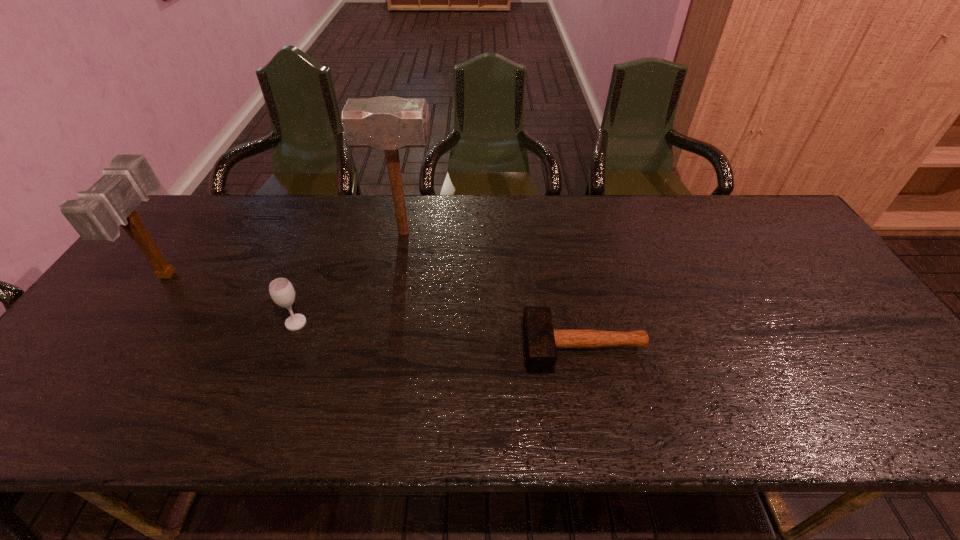
Locate an element on the screen. This screenshot has height=540, width=960. vacant area situated 0.310m on the left of the third tallest object is located at coordinates (163, 323).

Where is `free space located on the hammer head face of the shortest mallet`? The width and height of the screenshot is (960, 540). free space located on the hammer head face of the shortest mallet is located at coordinates (404, 347).

Identify the location of free space located on the hammer head face of the shortest mallet. (470, 347).

I want to click on vacant region located on the hammer head face of the shortest mallet, so click(x=396, y=347).

The height and width of the screenshot is (540, 960). What are the coordinates of `object at the far edge` in the screenshot? It's located at (385, 123).

What are the coordinates of `object that is positioned at the left edge` in the screenshot? It's located at (96, 215).

Locate an element on the screen. blank space at the far edge of the desktop is located at coordinates (523, 208).

The width and height of the screenshot is (960, 540). What are the coordinates of `free region at the near edge` in the screenshot? It's located at (611, 418).

Find the location of a particular element. Image resolution: width=960 pixels, height=540 pixels. free spot at the left edge of the desktop is located at coordinates (153, 308).

I want to click on vacant region at the far right corner of the desktop, so click(x=775, y=230).